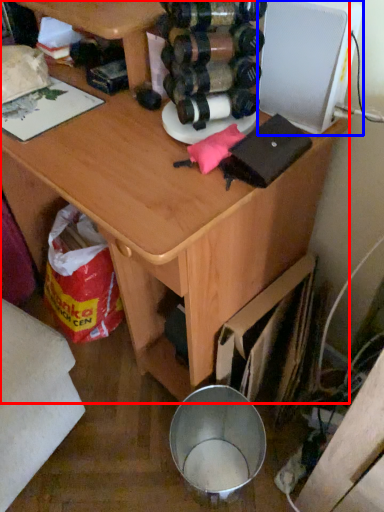
Question: Which object appears closest to the camera in this image, desk (highlighted by a red box) or appliance (highlighted by a blue box)?

Choices:
 (A) desk
 (B) appliance

Answer: (A)